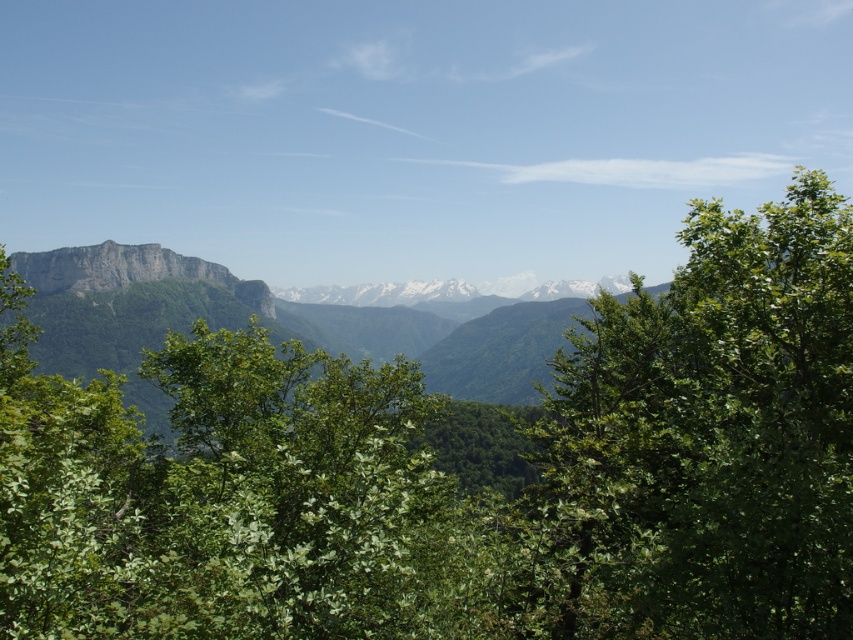
Question: Observing the image, what is the correct spatial positioning of green leafy tree at center in reference to green leafy tree at right?

Choices:
 (A) above
 (B) below

Answer: (B)

Question: Which point appears closest to the camera in this image?

Choices:
 (A) (196, 608)
 (B) (219, 266)

Answer: (A)

Question: Is green leafy tree at center above green leafy tree at right?

Choices:
 (A) yes
 (B) no

Answer: (B)

Question: Does green leafy tree at center appear on the right side of green leafy tree at right?

Choices:
 (A) no
 (B) yes

Answer: (A)

Question: Which point is farther from the camera taking this photo?

Choices:
 (A) (558, 532)
 (B) (393, 321)
 (C) (635, 634)

Answer: (B)

Question: Among these points, which one is nearest to the camera?

Choices:
 (A) (650, 380)
 (B) (486, 529)

Answer: (A)